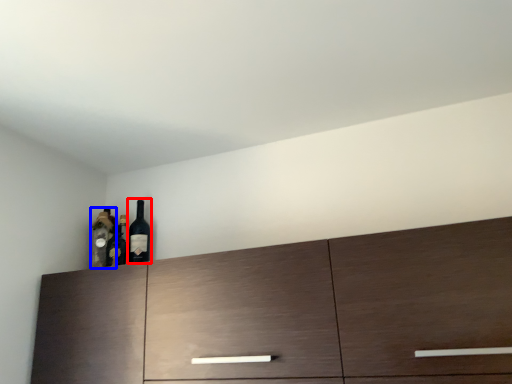
Question: Which of the following is the closest to the observer, wine bottle (highlighted by a red box) or bottle (highlighted by a blue box)?

Choices:
 (A) wine bottle
 (B) bottle

Answer: (A)